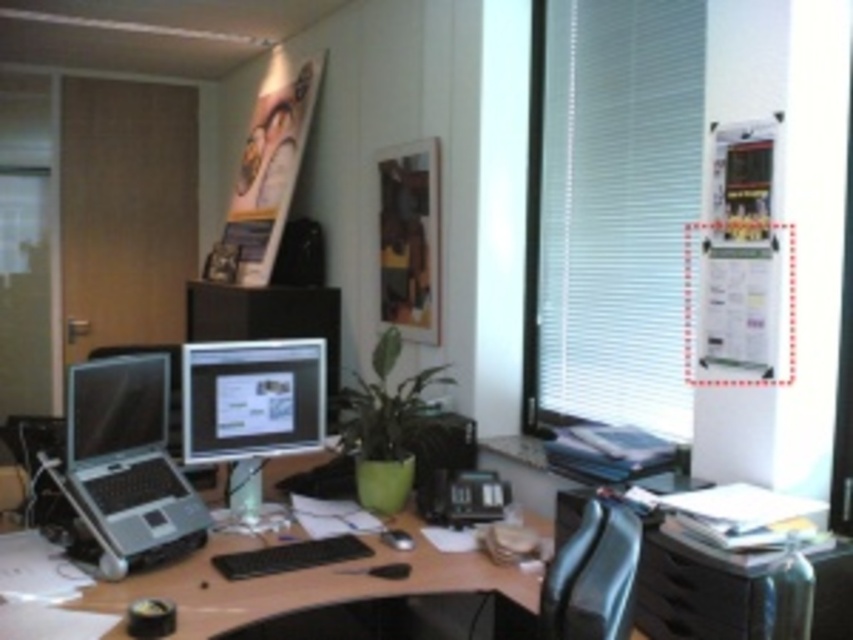
Looking at this image, which is more to the left, matte black laptop at left or matte black monitor at left?

From the viewer's perspective, matte black monitor at left appears more on the left side.

Can you confirm if matte black laptop at left is smaller than matte black monitor at left?

Actually, matte black laptop at left might be larger than matte black monitor at left.

Is point (67, 449) positioned before point (96, 449)?

Yes.

The height and width of the screenshot is (640, 853). I want to click on matte black laptop at left, so click(126, 464).

Is white matte blinds at right to the left of matte black monitor at center from the viewer's perspective?

In fact, white matte blinds at right is to the right of matte black monitor at center.

Which of these two, white matte blinds at right or matte black monitor at center, stands taller?

white matte blinds at right is taller.

This screenshot has height=640, width=853. I want to click on white matte blinds at right, so point(618,205).

Can you confirm if white matte blinds at right is positioned below matte black monitor at left?

No.

Looking at this image, is white matte blinds at right above matte black monitor at left?

Correct, white matte blinds at right is located above matte black monitor at left.

Is point (631, 48) closer to camera compared to point (109, 417)?

No, (631, 48) is behind (109, 417).

Find the location of a particular element. The image size is (853, 640). white matte blinds at right is located at coordinates (x=618, y=205).